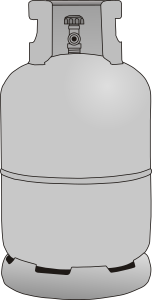
The height and width of the screenshot is (300, 152). I want to click on handle, so click(x=47, y=24), click(x=109, y=25).